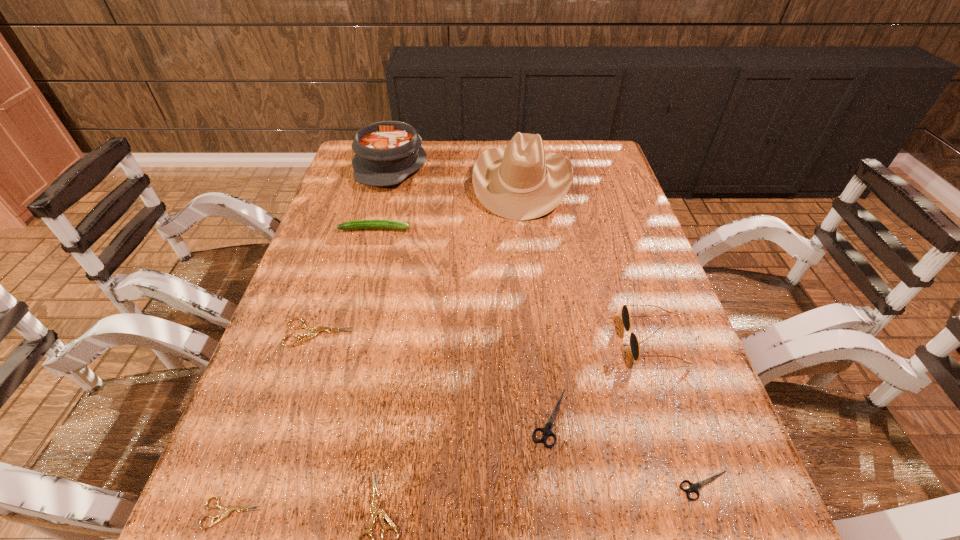
Locate an element on the screen. The width and height of the screenshot is (960, 540). the biggest beige shears is located at coordinates (316, 330).

At what (x,y) coordinates should I click in order to perform the action: click on the farthest beige shears. Please return your answer as a coordinate pair (x, y). Looking at the image, I should click on (316, 330).

You are a GUI agent. You are given a task and a screenshot of the screen. Output one action in this format:
    pyautogui.click(x=<x>, y=<y>)
    Task: Click on the nearer black shears
    
    Given the screenshot: What is the action you would take?
    pyautogui.click(x=694, y=487)

Identify the location of the right black shears. This screenshot has width=960, height=540. (694, 487).

You are a GUI agent. You are given a task and a screenshot of the screen. Output one action in this format:
    pyautogui.click(x=<x>, y=<y>)
    Task: Click on the shortest object
    Image resolution: width=960 pixels, height=540 pixels.
    Given the screenshot: What is the action you would take?
    pyautogui.click(x=229, y=509)

At what (x,y) coordinates should I click in order to perform the action: click on the shortest shears. Please return your answer as a coordinate pair (x, y). Image resolution: width=960 pixels, height=540 pixels. Looking at the image, I should click on (229, 509).

Where is `free space located on the back of the cowboy hat`? The height and width of the screenshot is (540, 960). free space located on the back of the cowboy hat is located at coordinates (517, 139).

Locate an element on the screen. free space located 0.380m on the right of the eighth shortest object is located at coordinates tap(541, 165).

Locate an element on the screen. This screenshot has height=540, width=960. vacant space located on the front-facing side of the third tallest object is located at coordinates (520, 339).

Locate an element on the screen. vacant space located 0.080m on the front-facing side of the third tallest object is located at coordinates (588, 339).